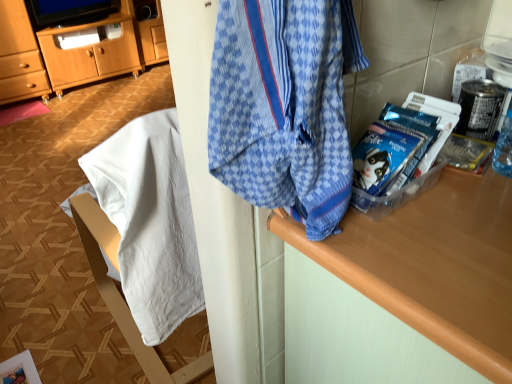
The width and height of the screenshot is (512, 384). What do you see at coordinates (284, 106) in the screenshot? I see `blue patterned fabric at upper right` at bounding box center [284, 106].

What is the approximate height of blue patterned fabric at upper right?

blue patterned fabric at upper right is 12.93 inches tall.

At what (x,y) coordinates should I click in order to perform the action: click on blue patterned fabric at upper right. Please return your answer as a coordinate pair (x, y). The image size is (512, 384). Looking at the image, I should click on (284, 106).

This screenshot has height=384, width=512. I want to click on blue patterned fabric at upper right, so click(x=284, y=106).